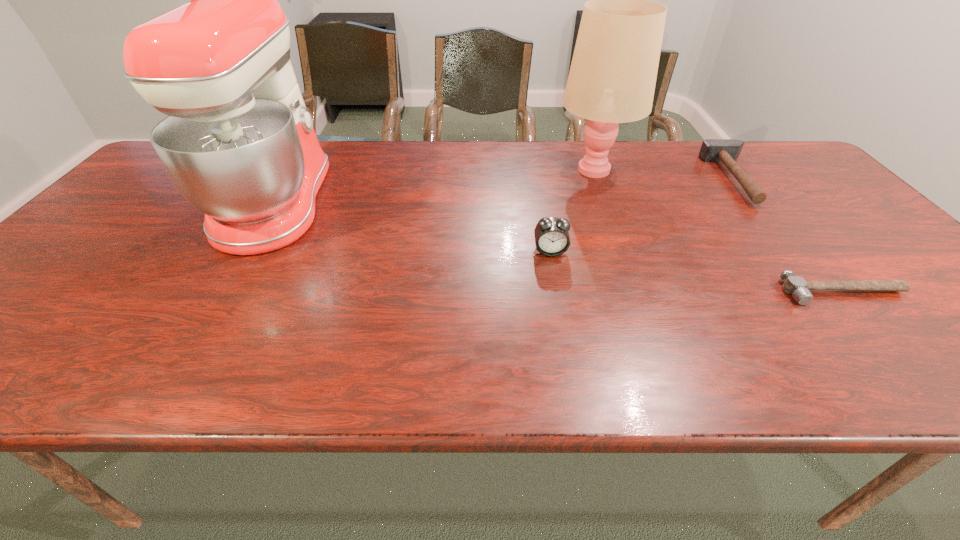
Identify the location of free space between the lampshade and the second object from left to right. (572, 210).

Locate an element on the screen. Image resolution: width=960 pixels, height=540 pixels. vacant point located between the lampshade and the shortest object is located at coordinates (718, 230).

Image resolution: width=960 pixels, height=540 pixels. I want to click on free point between the taller hammer and the lampshade, so click(665, 174).

Where is `vacant region between the shortest object and the third shortest object`? This screenshot has height=540, width=960. vacant region between the shortest object and the third shortest object is located at coordinates (696, 272).

Locate an element on the screen. The height and width of the screenshot is (540, 960). object that is the closest to the farther hammer is located at coordinates (612, 78).

Identify which object is the third closest to the nearer hammer. Please provide its 2D coordinates. Your answer should be formatted as a tuple, i.e. [(x, y)], where the tuple contains the x and y coordinates of a point satisfying the conditions above.

[(552, 239)]

I want to click on free spot that satisfies the following two spatial constraints: 1. on the striking surface of the farther hammer; 2. on the front side of the second object from left to right, so click(x=796, y=252).